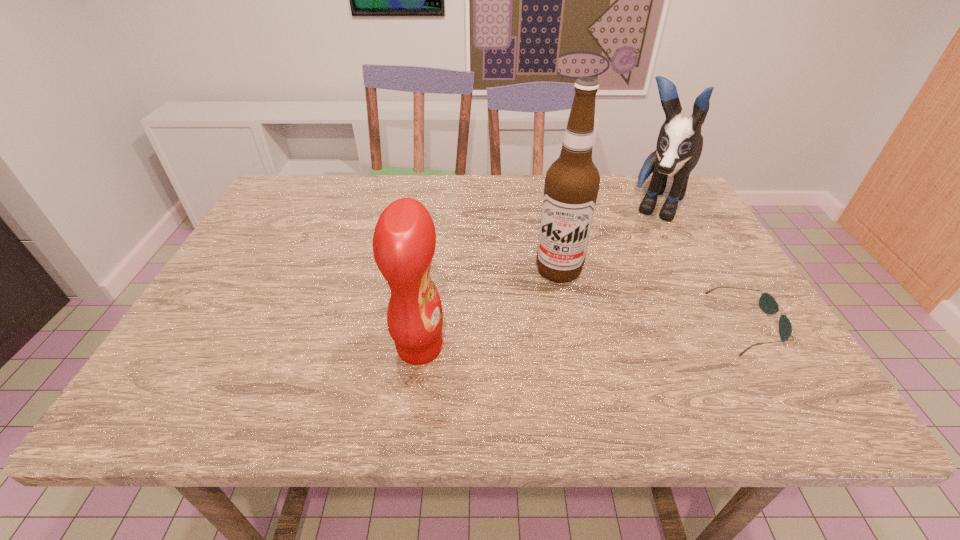
Image resolution: width=960 pixels, height=540 pixels. I want to click on free space on the desktop that is between the leftmost object and the shortest object and is positioned on the front-facing side of the third shortest object, so click(586, 336).

Find the location of a particular element. The height and width of the screenshot is (540, 960). free space on the desktop that is between the third tallest object and the sunglasses and is positioned on the label of the alcohol is located at coordinates (543, 339).